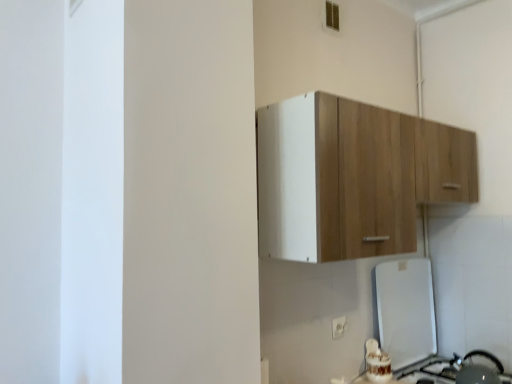
Question: Can you see wooden cabinet at upper center touching metallic silver kettle at lower right, arranged as the 2th appliance when viewed from the top?

Choices:
 (A) no
 (B) yes

Answer: (A)

Question: From a real-world perspective, is wooden cabinet at upper center physically below metallic silver kettle at lower right, the 1th appliance from the bottom?

Choices:
 (A) yes
 (B) no

Answer: (B)

Question: Is wooden cabinet at upper center at the left side of metallic silver kettle at lower right, arranged as the 2th appliance when viewed from the top?

Choices:
 (A) no
 (B) yes

Answer: (B)

Question: Does wooden cabinet at upper center have a smaller size compared to metallic silver kettle at lower right, the 1th appliance from the bottom?

Choices:
 (A) no
 (B) yes

Answer: (A)

Question: From a real-world perspective, is wooden cabinet at upper center positioned over metallic silver kettle at lower right, arranged as the 2th appliance when viewed from the top, based on gravity?

Choices:
 (A) no
 (B) yes

Answer: (B)

Question: Is point (332, 324) positioned closer to the camera than point (486, 377)?

Choices:
 (A) closer
 (B) farther

Answer: (B)

Question: From a real-world perspective, is white plastic electric outlet at lower center positioned above or below metallic silver kettle at lower right, arranged as the 2th appliance when viewed from the top?

Choices:
 (A) below
 (B) above

Answer: (B)

Question: Is white plastic electric outlet at lower center in front of or behind metallic silver kettle at lower right, arranged as the 2th appliance when viewed from the top, in the image?

Choices:
 (A) behind
 (B) front

Answer: (A)

Question: In the image, is white plastic electric outlet at lower center on the left side or the right side of metallic silver kettle at lower right, arranged as the 2th appliance when viewed from the top?

Choices:
 (A) right
 (B) left

Answer: (B)

Question: Considering the positions of white glossy refrigerator at lower right, which is the first appliance from top to bottom, and white plastic electric outlet at lower center in the image, is white glossy refrigerator at lower right, which is the first appliance from top to bottom, taller or shorter than white plastic electric outlet at lower center?

Choices:
 (A) tall
 (B) short

Answer: (A)

Question: In the image, is white glossy refrigerator at lower right, which is the first appliance from top to bottom, on the left side or the right side of white plastic electric outlet at lower center?

Choices:
 (A) right
 (B) left

Answer: (A)

Question: From the image's perspective, relative to white plastic electric outlet at lower center, is white glossy refrigerator at lower right, acting as the 2th appliance starting from the bottom, above or below?

Choices:
 (A) above
 (B) below

Answer: (B)

Question: Choose the correct answer: Is white glossy refrigerator at lower right, which is the first appliance from top to bottom, inside white plastic electric outlet at lower center or outside it?

Choices:
 (A) inside
 (B) outside

Answer: (B)

Question: Relative to white plastic electric outlet at lower center, is wooden cabinet at upper center in front or behind?

Choices:
 (A) front
 (B) behind

Answer: (A)

Question: From a real-world perspective, is wooden cabinet at upper center above or below white plastic electric outlet at lower center?

Choices:
 (A) below
 (B) above

Answer: (B)